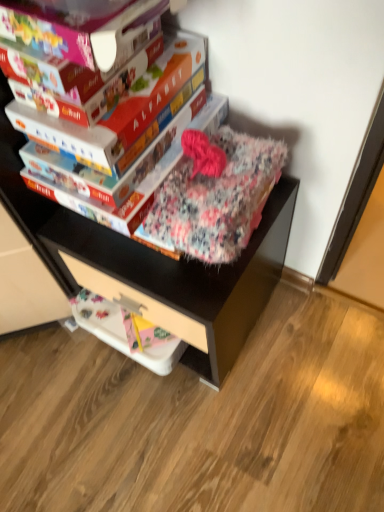
Question: Would you say white plastic drawer at lower center is inside or outside matte cardboard book at upper center, the second paperback book from the back?

Choices:
 (A) inside
 (B) outside

Answer: (B)

Question: Considering the positions of point (167, 312) and point (112, 145), is point (167, 312) closer or farther from the camera than point (112, 145)?

Choices:
 (A) farther
 (B) closer

Answer: (A)

Question: Which object is the farthest from the white plastic drawer at lower center?

Choices:
 (A) fluffy fabric bag at upper center
 (B) matte cardboard book at center, the 3th paperback book in the front-to-back sequence
 (C) fluffy floral blanket at center
 (D) matte cardboard book at upper left, positioned as the first paperback book in front-to-back order
 (E) matte cardboard book at upper center, the 2th paperback book in the front-to-back sequence

Answer: (D)

Question: Which is nearer to the matte cardboard book at center, the 3th paperback book in the front-to-back sequence?

Choices:
 (A) fluffy fabric bag at upper center
 (B) matte cardboard book at upper center, the second paperback book from the back
 (C) white plastic drawer at lower center
 (D) matte cardboard book at upper left, positioned as the first paperback book in front-to-back order
 (E) fluffy floral blanket at center

Answer: (B)